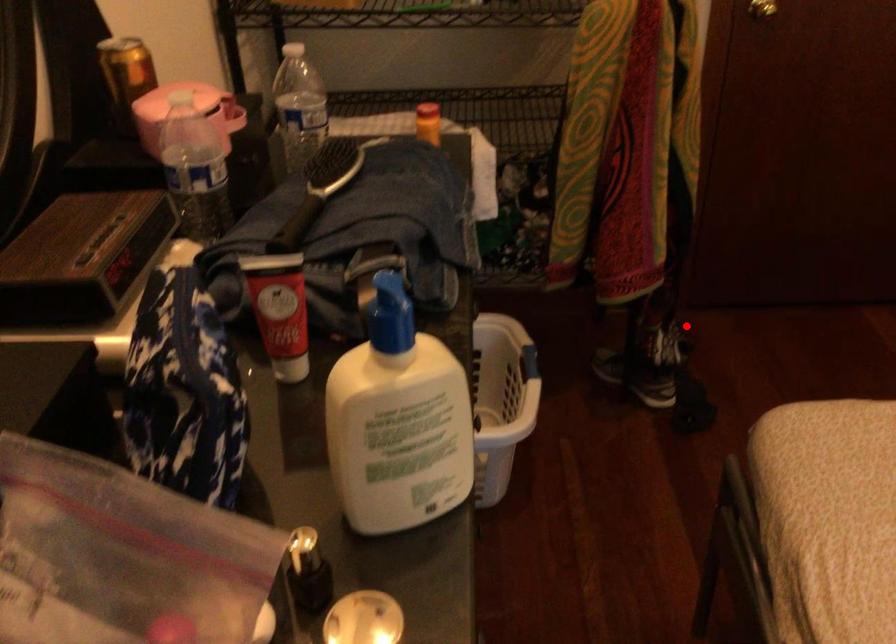
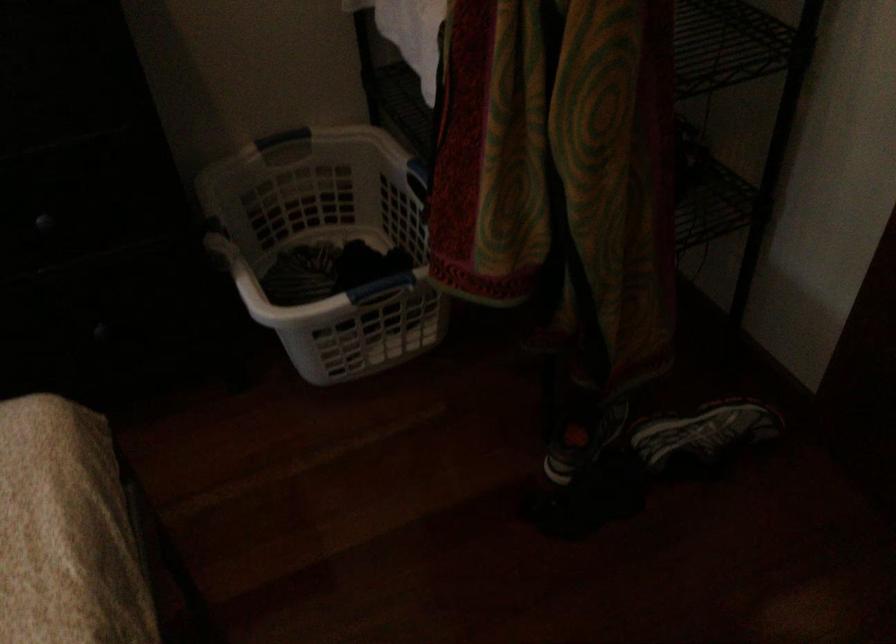
Question: A red point is marked in image1. In image2, is the corresponding 3D point closer to the camera or farther? Reply with the corresponding letter.

Choices:
 (A) The corresponding 3D point is closer.
 (B) The corresponding 3D point is farther.

Answer: (A)